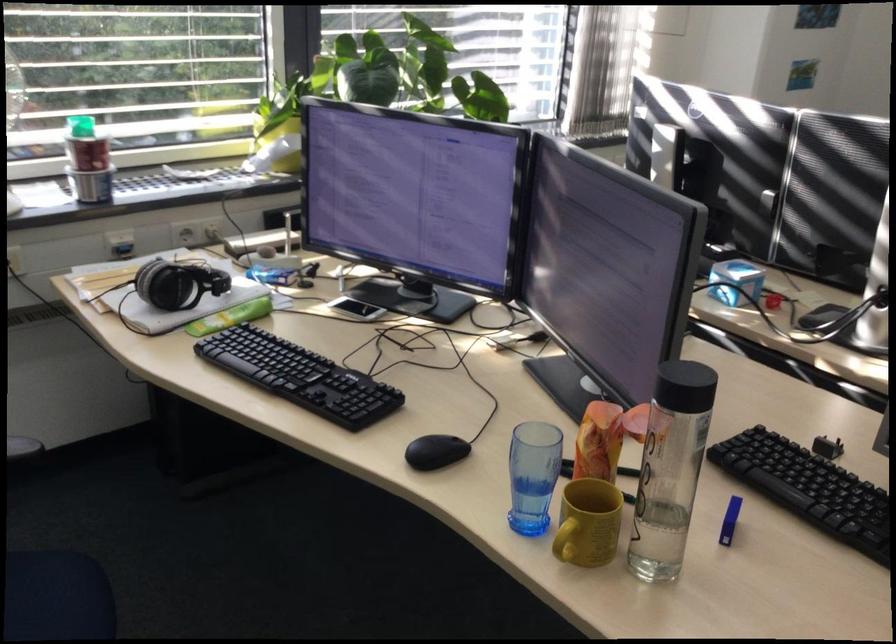
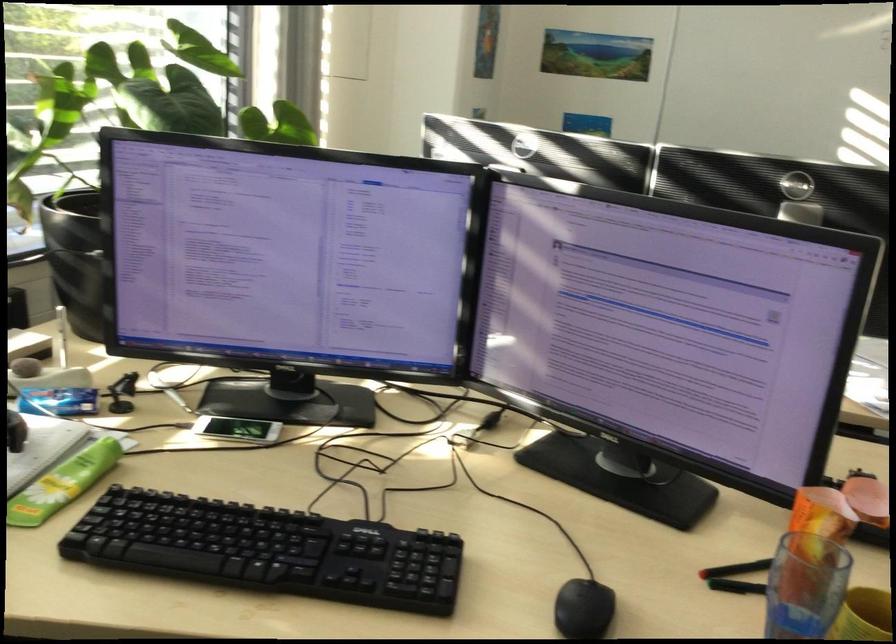
Where in the second image is the point corresponding to point 596,469 from the first image?

(736, 569)